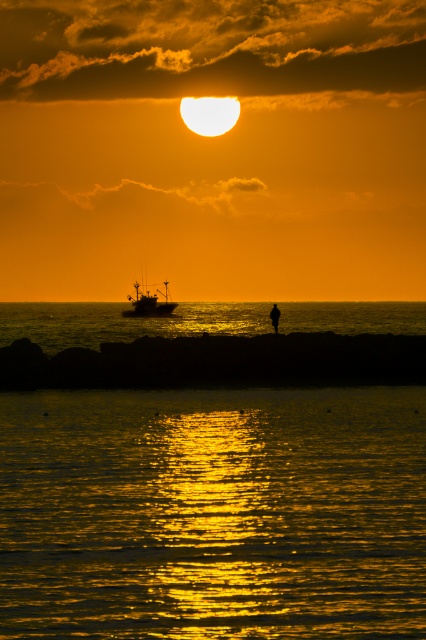
You are a photographer trying to capture the silhouette fishing boat at center and the glistening golden water at center in one frame. Given that your camera has a maximum focus range of 100 meters, will you be able to clearly capture both subjects in the same shot?

The distance between the glistening golden water at center and the silhouette fishing boat at center is 111.85 meters. Since your camera can only focus up to 100 meters, it will not be able to capture both subjects clearly in the same frame.